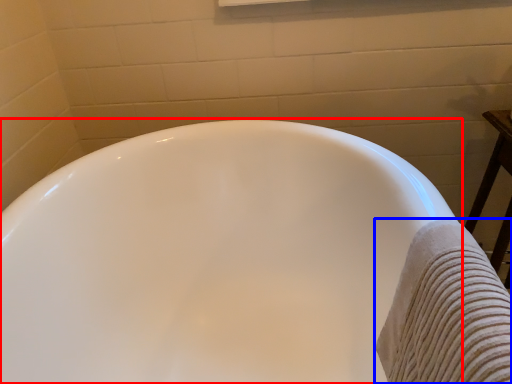
Question: Which object appears farthest to the camera in this image, bathtub (highlighted by a red box) or bath towel (highlighted by a blue box)?

Choices:
 (A) bathtub
 (B) bath towel

Answer: (A)